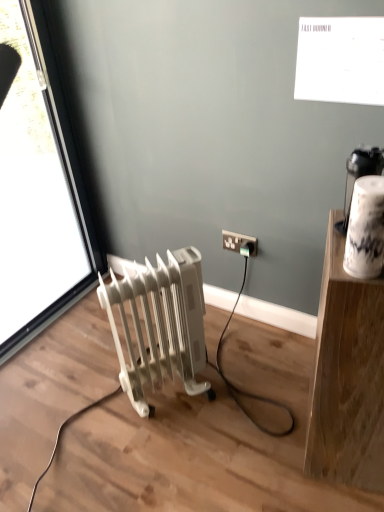
What are the coordinates of `free space to the left of white plastic radiator at lower left` in the screenshot? It's located at (93, 406).